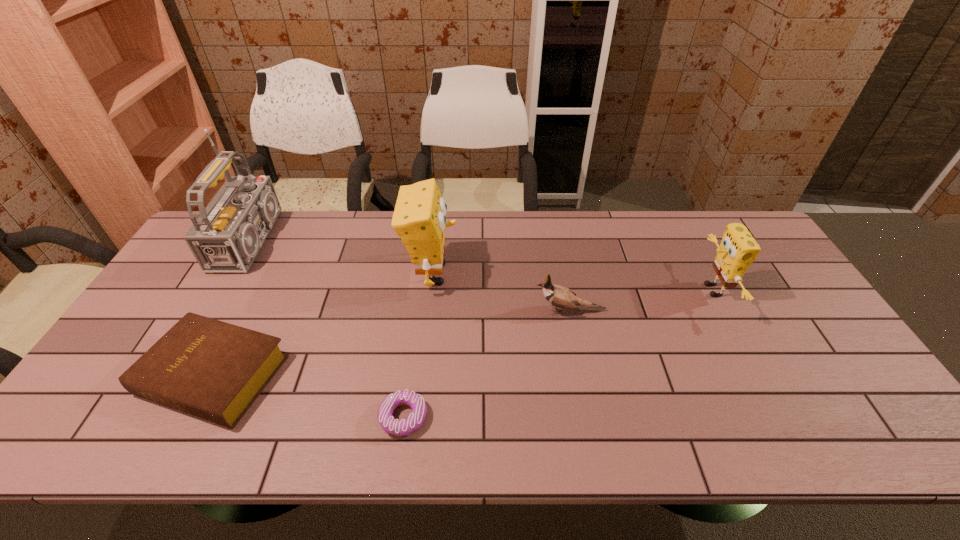
I want to click on sponge that is positioned at the far edge, so click(419, 220).

Image resolution: width=960 pixels, height=540 pixels. Find the location of `Bible that is at the near edge`. Bible that is at the near edge is located at coordinates (214, 370).

Locate an element on the screen. This screenshot has width=960, height=540. doughnut situated at the near edge is located at coordinates (404, 427).

Locate an element on the screen. This screenshot has width=960, height=540. radio receiver positioned at the left edge is located at coordinates (228, 234).

You are a GUI agent. You are given a task and a screenshot of the screen. Output one action in this format:
    pyautogui.click(x=<x>, y=<y>)
    Task: Click on the Bible located at the left edge
    The image size is (960, 540).
    Given the screenshot: What is the action you would take?
    (214, 370)

Where is `object present at the far left corner`? object present at the far left corner is located at coordinates (228, 234).

Where is `object located in the near left corner section of the desktop`? The width and height of the screenshot is (960, 540). object located in the near left corner section of the desktop is located at coordinates (214, 370).

Locate an element on the screen. The height and width of the screenshot is (540, 960). free location at the far edge of the desktop is located at coordinates (672, 219).

Image resolution: width=960 pixels, height=540 pixels. Find the location of `free space at the near edge of the desktop`. free space at the near edge of the desktop is located at coordinates (173, 443).

Image resolution: width=960 pixels, height=540 pixels. I want to click on free space at the left edge, so click(x=190, y=271).